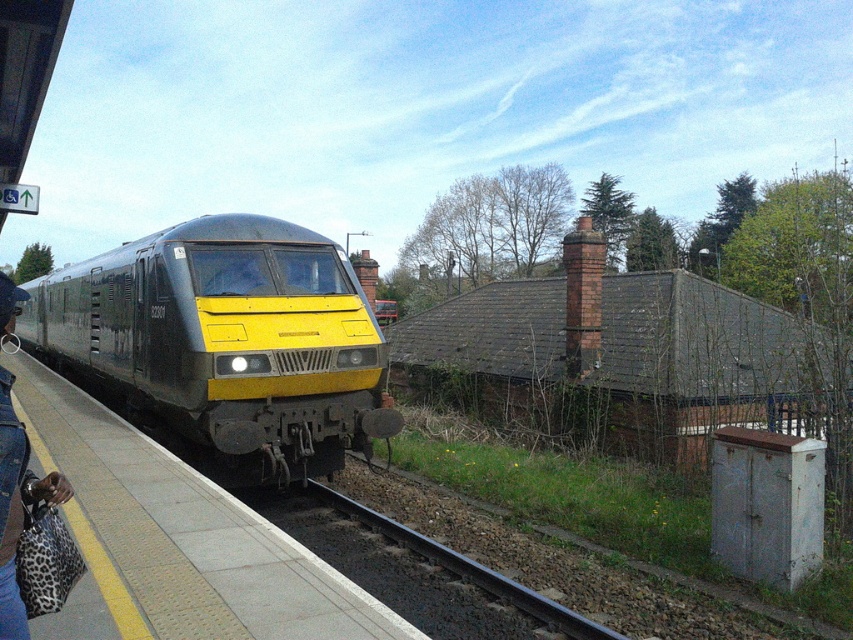
You are a passenger at the station holding a leopard print bag at platform left. The train is approaching on the black gravel train track at lower center. If the train is moving at 30 km per hour, will you have enough time to safely step back onto the platform before the train passes by?

The leopard print bag at platform left is 2.96 meters away from the black gravel train track at lower center. At 30 km per hour, the train is moving at approximately 8.33 meters per second. The distance between the bag and the track is only 2.96 meters, which the train would cover in about 0.35 seconds. This is not enough time to safely step back onto the platform before the train passes by.

You are a passenger standing on the platform and see the metallic yellow train at center and the leopard print bag at platform left. Which object is positioned higher in the image?

The metallic yellow train at center is above the leopard print bag at platform left, so it is positioned higher in the image.

You are a maintenance worker at the station and need to inspect the gap between the metallic yellow train at center and the concrete platform at center. The safety protocol requires that this gap must not exceed 3 meters. Is the current gap within the safety limit?

The distance between the metallic yellow train at center and the concrete platform at center is 4.08 meters, which exceeds the 3 meter safety limit. The gap is not within the safety limit.